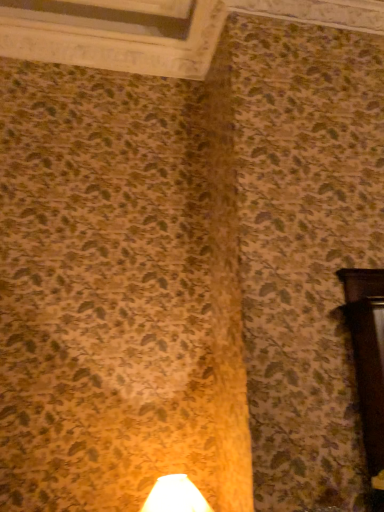
This screenshot has height=512, width=384. What do you see at coordinates (111, 38) in the screenshot?
I see `white textured frame at upper left` at bounding box center [111, 38].

You are a GUI agent. You are given a task and a screenshot of the screen. Output one action in this format:
    pyautogui.click(x=<x>, y=<y>)
    Task: Click on the white textured frame at upper left
    This screenshot has width=384, height=512.
    Given the screenshot: What is the action you would take?
    pyautogui.click(x=111, y=38)

Where is `white textured frame at upper left`? white textured frame at upper left is located at coordinates tap(111, 38).